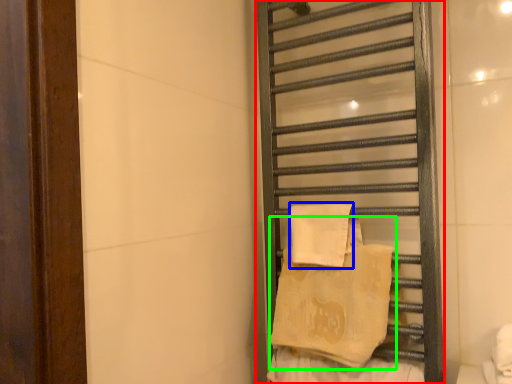
Question: Estimate the real-world distances between objects in this image. Which object is closer to towel rack (highlighted by a red box), beach towel (highlighted by a blue box) or beach towel (highlighted by a green box)?

Choices:
 (A) beach towel
 (B) beach towel

Answer: (B)